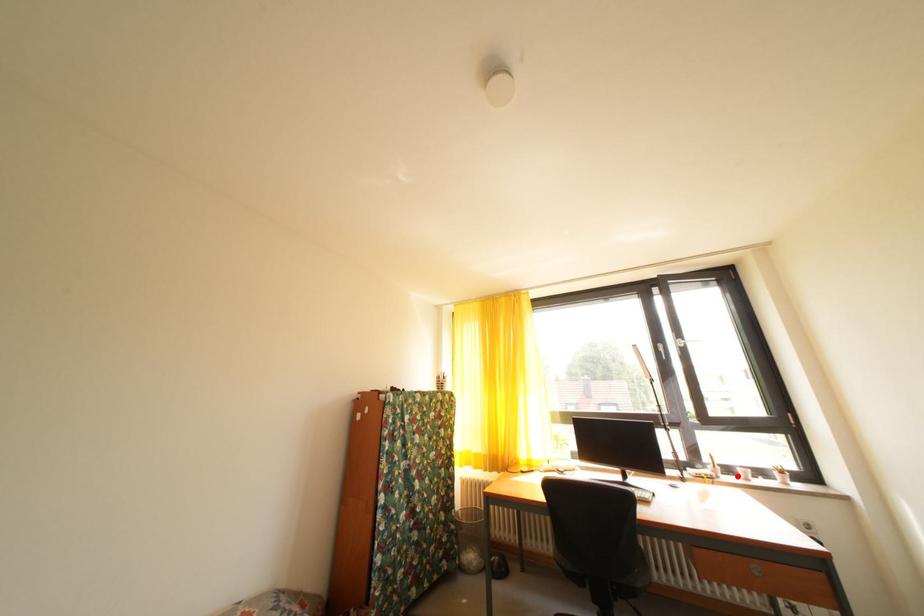
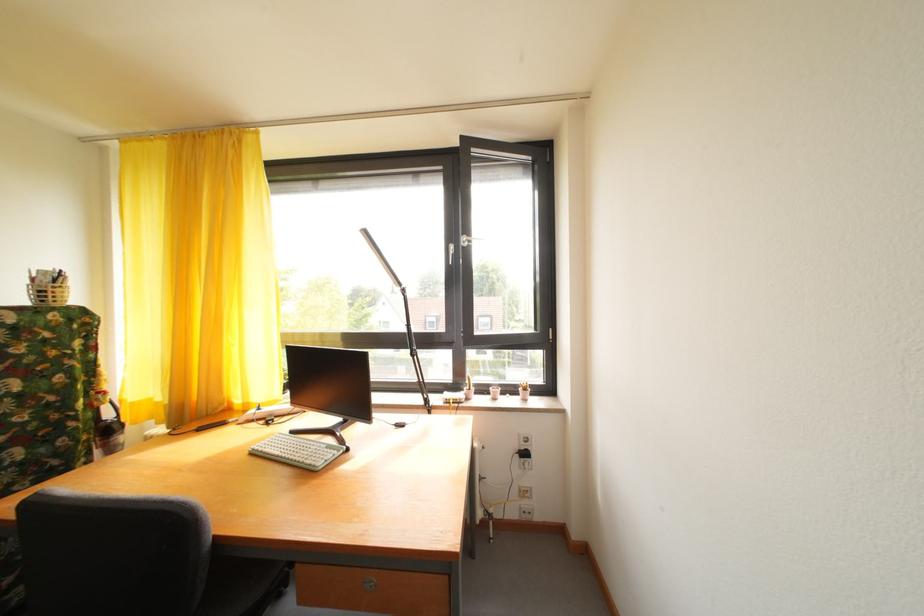
Question: I am providing you with two images of the same scene from different viewpoints. In image1, a red point is highlighted. Considering the same 3D point in image2, which of the following is correct?

Choices:
 (A) It is closer
 (B) It is farther

Answer: (B)